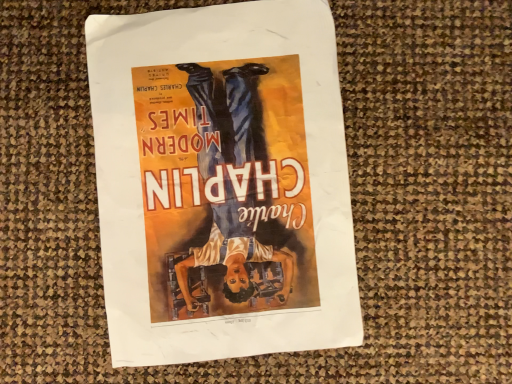
You are a GUI agent. You are given a task and a screenshot of the screen. Output one action in this format:
    pyautogui.click(x=<x>, y=<y>)
    Task: Click on the free space above matte paper poster at center (from a real-world perspective)
    The image size is (512, 384).
    Given the screenshot: What is the action you would take?
    [x=215, y=179]